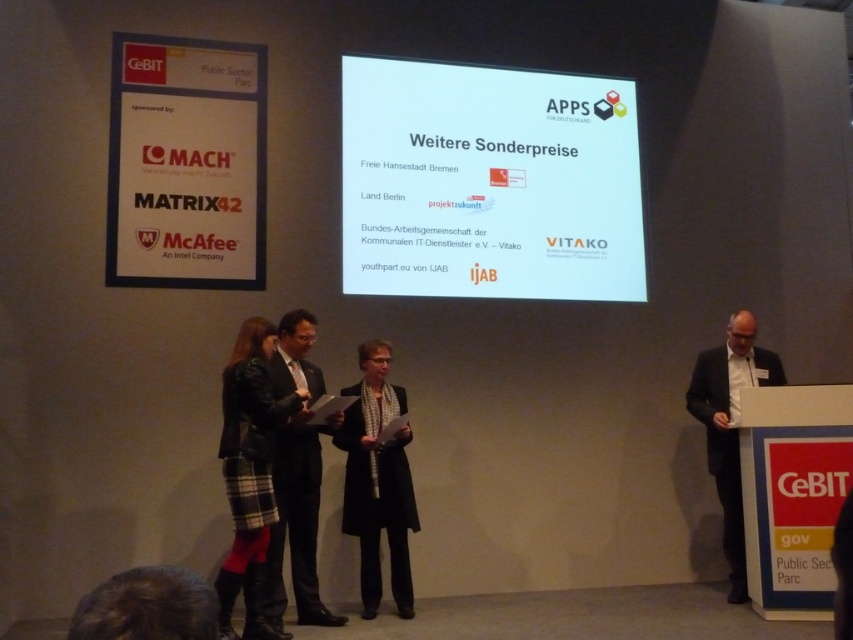
Is plaid fabric skirt at center wider than dark suit at center?

Indeed, plaid fabric skirt at center has a greater width compared to dark suit at center.

Can you confirm if plaid fabric skirt at center is positioned to the left of dark suit at center?

Yes, plaid fabric skirt at center is to the left of dark suit at center.

Identify the location of plaid fabric skirt at center. (250, 474).

Between plaid fabric skirt at center and dark suit at right, which one appears on the right side from the viewer's perspective?

dark suit at right is more to the right.

Between point (241, 396) and point (740, 554), which one is positioned behind?

The point (740, 554) is more distant.

At what (x,y) coordinates should I click in order to perform the action: click on plaid fabric skirt at center. Please return your answer as a coordinate pair (x, y). The height and width of the screenshot is (640, 853). Looking at the image, I should click on click(250, 474).

Which is more to the right, white glossy projection screen at center or dark suit at center?

white glossy projection screen at center is more to the right.

Is the position of white glossy projection screen at center less distant than that of dark suit at center?

No, it is not.

Who is more distant from viewer, (393,248) or (305,376)?

The point (393,248) is more distant.

The width and height of the screenshot is (853, 640). I want to click on white glossy projection screen at center, so click(488, 182).